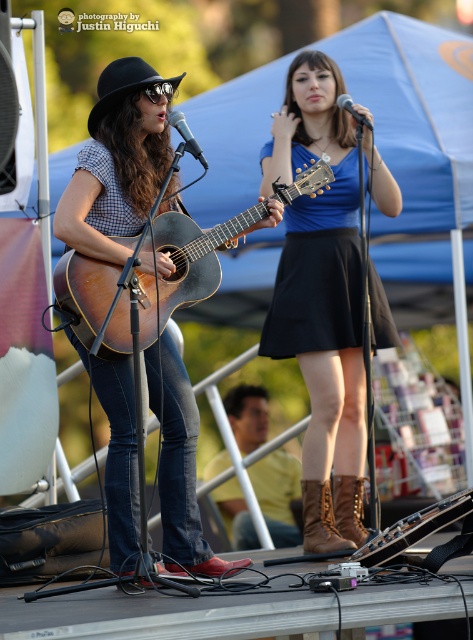
Image resolution: width=473 pixels, height=640 pixels. Describe the element at coordinates (350, 508) in the screenshot. I see `brown suede cowboy boot at lower right` at that location.

Does brown suede cowboy boot at lower right have a lesser width compared to metallic silver microphone at upper center?

No, brown suede cowboy boot at lower right is not thinner than metallic silver microphone at upper center.

Describe the element at coordinates (350, 508) in the screenshot. I see `brown suede cowboy boot at lower right` at that location.

The width and height of the screenshot is (473, 640). In order to click on brown suede cowboy boot at lower right in this screenshot , I will do `click(350, 508)`.

Can you confirm if acoustic wood guitar at center is positioned to the right of brown leather cowboy boot at lower center?

Incorrect, acoustic wood guitar at center is not on the right side of brown leather cowboy boot at lower center.

Is acoustic wood guitar at center behind brown leather cowboy boot at lower center?

No.

Which is in front, point (148, 253) or point (322, 529)?

Positioned in front is point (148, 253).

The image size is (473, 640). Identify the location of acoustic wood guitar at center. (183, 266).

Does matte brown guitar at left have a greater width compared to brown suede cowboy boot at lower right?

Yes.

Does matte brown guitar at left come behind brown suede cowboy boot at lower right?

No, matte brown guitar at left is closer to the viewer.

Who is more forward, (132, 512) or (357, 545)?

Point (132, 512) is in front.

The width and height of the screenshot is (473, 640). I want to click on matte brown guitar at left, so click(117, 161).